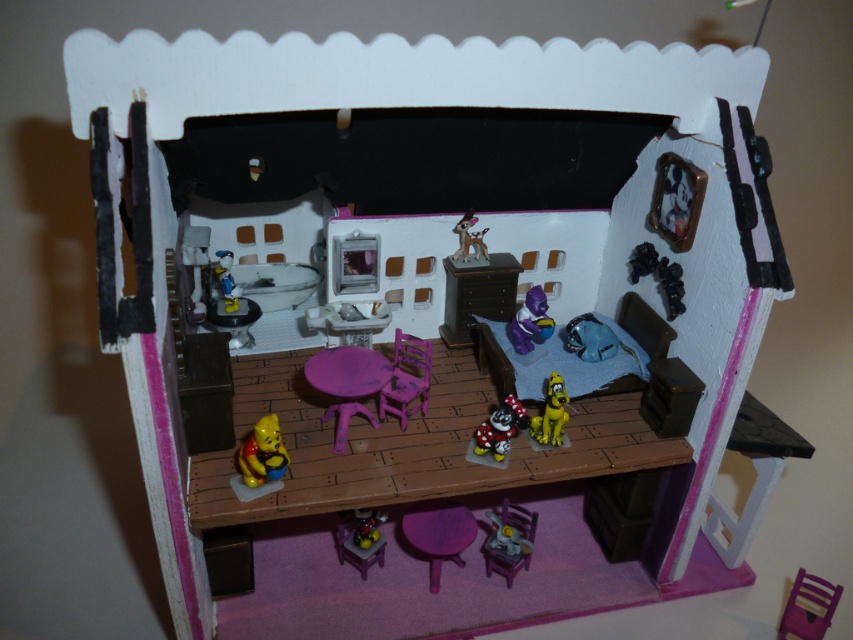
You are a visitor in the dollhouse and want to place a new decoration. The matte plastic dog at center is currently blocking the view of the metallic silver figurine at center. How can you adjust their positions to ensure both are visible?

Since the matte plastic dog at center is below the metallic silver figurine at center, you can move the dog slightly forward or backward so that both objects are visible without one blocking the other.

In the dollhouse living room, there is a purple plastic table at center and a matte brown deer at center. Which object is positioned to the left when viewed from the front?

The purple plastic table at center is to the left of the matte brown deer at center when viewed from the front.

You are trying to fit a new decorative item into the dollhouse. The item is 15 cm wide. You have two options to place it next to either the purple plastic table at center or the matte brown deer at center. Which object allows more space for the item based on their widths?

The purple plastic table at center has a larger width than the matte brown deer at center, so placing the item next to the purple plastic table at center would provide more space.